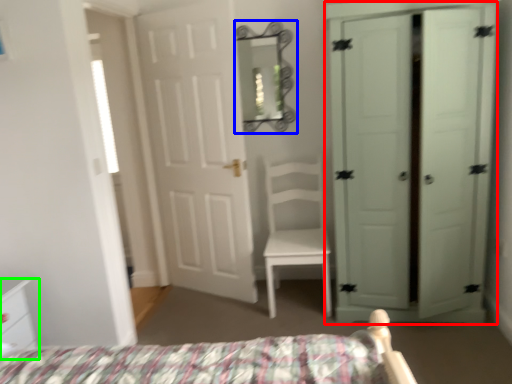
Question: Which object is the farthest from door (highlighted by a red box)? Choose among these: mirror (highlighted by a blue box) or nightstand (highlighted by a green box).

Choices:
 (A) mirror
 (B) nightstand

Answer: (B)